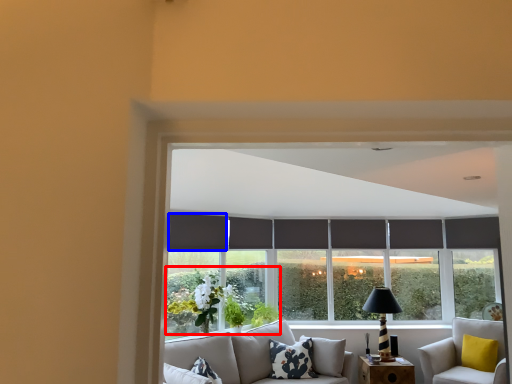
Question: Which point is closer to the camera, plant (highlighted by a red box) or curtain (highlighted by a blue box)?

Choices:
 (A) plant
 (B) curtain

Answer: (A)